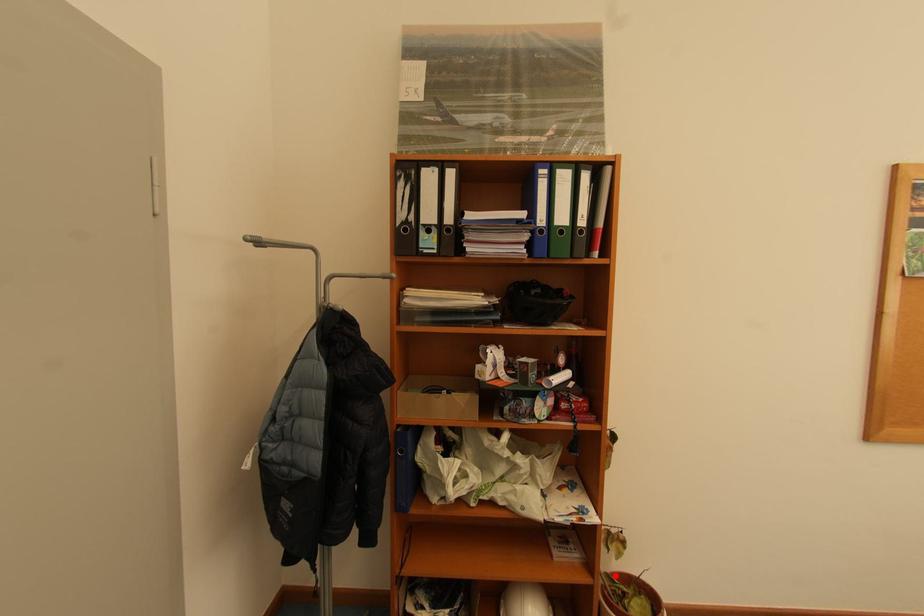
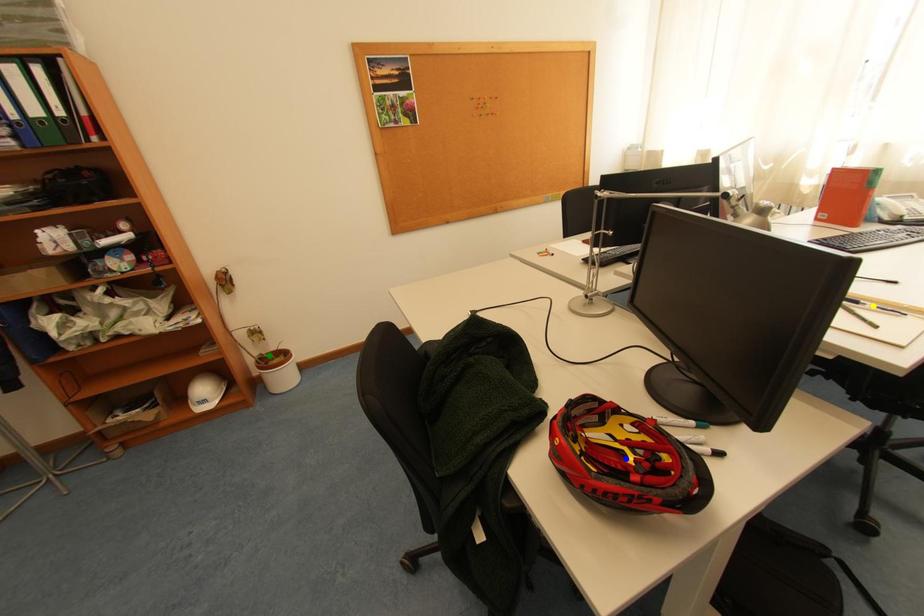
Question: I am providing you with two images of the same scene from different viewpoints. A red point is marked on the first image. You are given multiple points on the second image. Which mark in image 2 goes with the point in image 1?

Choices:
 (A) green point
 (B) blue point
 (C) yellow point

Answer: (A)